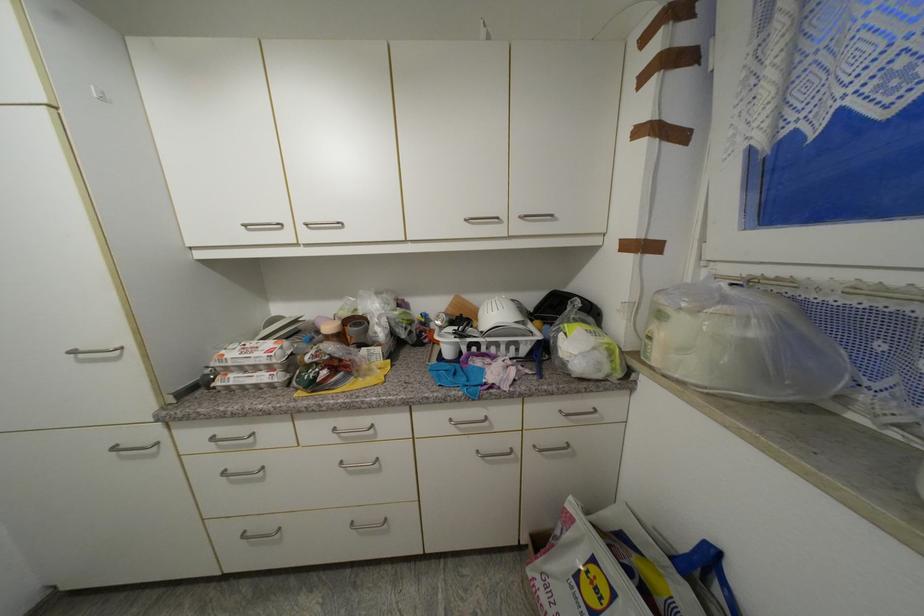
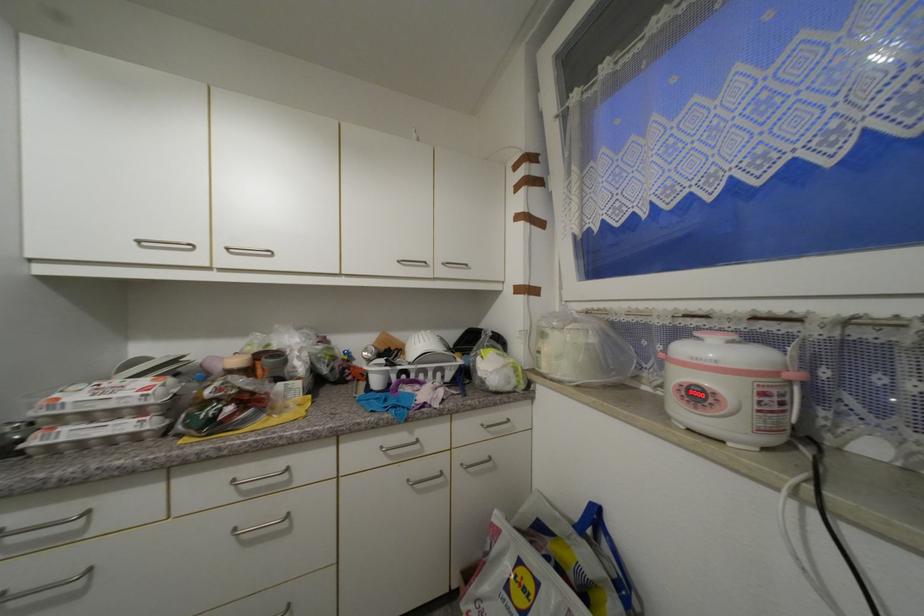
Find the pixel in the second image that matches pixel 566 413 in the first image.

(488, 427)